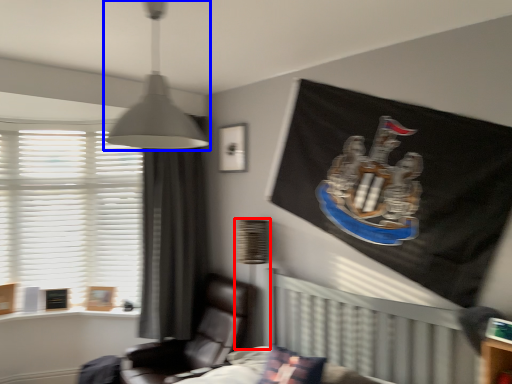
Question: Which object is closer to the camera taking this photo, table lamp (highlighted by a red box) or lamp (highlighted by a blue box)?

Choices:
 (A) table lamp
 (B) lamp

Answer: (B)